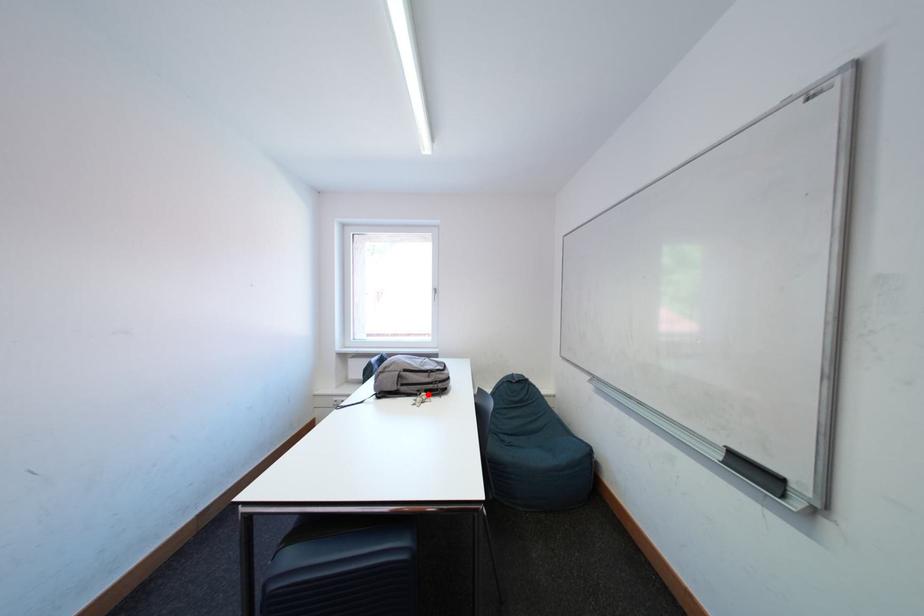
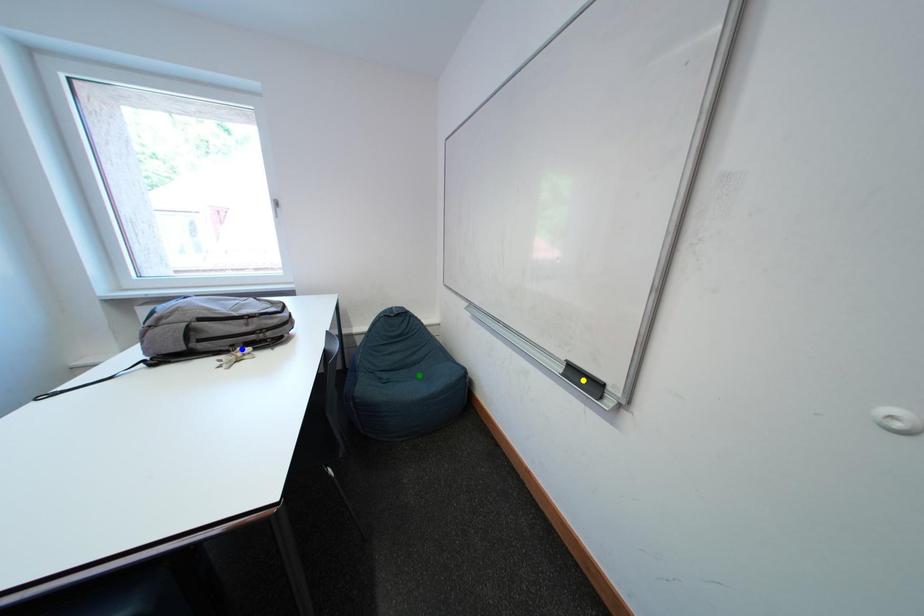
Question: I am providing you with two images of the same scene from different viewpoints. A red point is marked on the first image. You are given multiple points on the second image. Which spot in image 2 lines up with the point in image 1?

Choices:
 (A) green point
 (B) blue point
 (C) yellow point

Answer: (B)